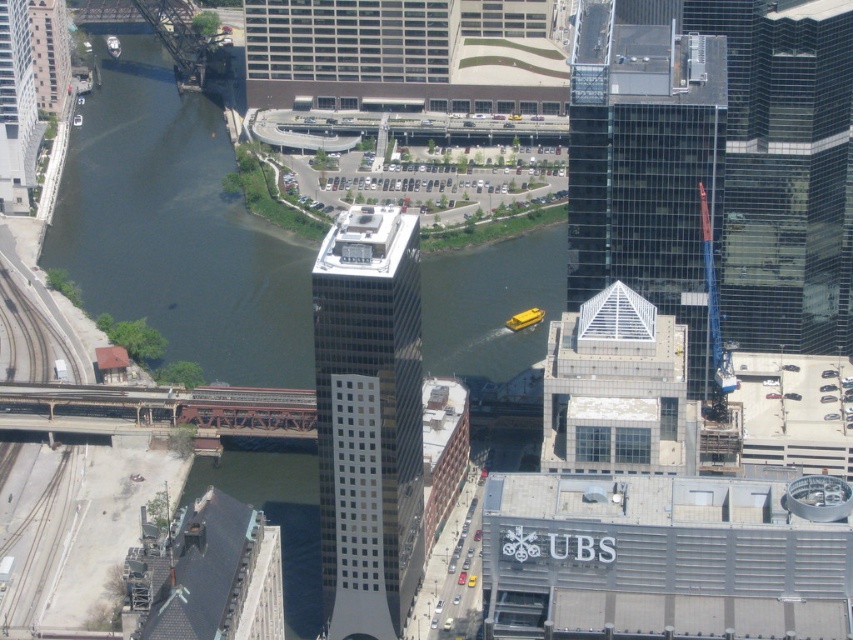
You are a city planner analyzing this urban area. You need to determine which of the two elements, the dark green water at left or the transparent glass skyscraper at center, occupies a larger horizontal space in the image. Based on the aerial view provided, which one is wider?

The dark green water at left is wider than the transparent glass skyscraper at center because its width surpasses that of the skyscraper.

You are a drone operator flying over the city. Your task is to deliver a package to the rooftop of the metallic glass skyscraper at center. However, you must avoid flying over the dark green water at left. Based on the scene, can you safely navigate to the skyscraper without crossing the water?

The dark green water at left is located above the metallic glass skyscraper at center, so the water is actually above the skyscraper. This means the drone cannot fly to the skyscraper without passing through the water, making the delivery impossible.